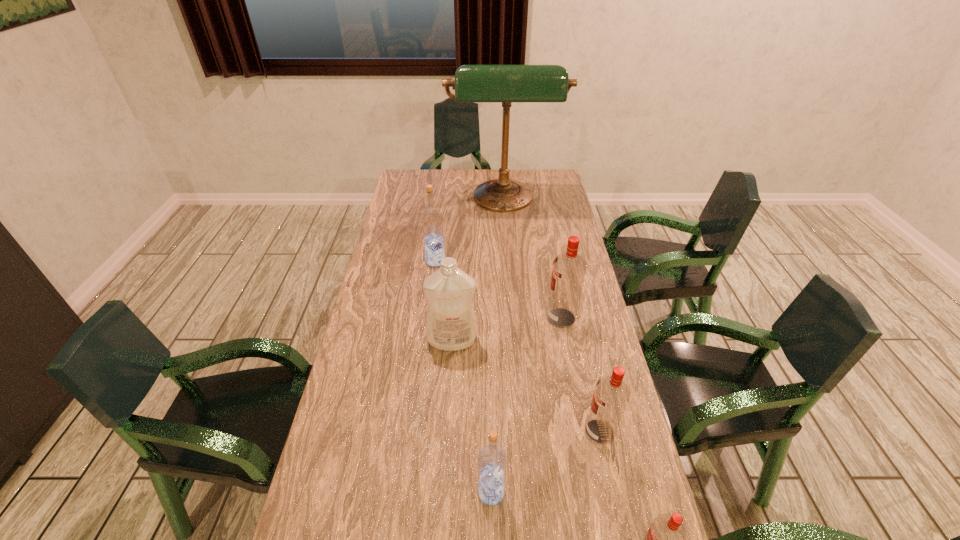
This screenshot has width=960, height=540. Find the location of `the farthest object`. the farthest object is located at coordinates (472, 83).

The image size is (960, 540). In order to click on the tallest object in this screenshot , I will do [x=472, y=83].

Identify the location of the farthest red vodka. The height and width of the screenshot is (540, 960). (568, 271).

Locate an element on the screen. Image resolution: width=960 pixels, height=540 pixels. the biggest red vodka is located at coordinates (568, 271).

I want to click on the sixth nearest object, so click(432, 223).

The height and width of the screenshot is (540, 960). I want to click on the farther blue vodka, so click(432, 223).

Where is `white detergent`? This screenshot has width=960, height=540. white detergent is located at coordinates (450, 321).

Image resolution: width=960 pixels, height=540 pixels. Identify the location of the third nearest object. (611, 395).

Identify the location of the second farthest red vodka. (611, 395).

Image resolution: width=960 pixels, height=540 pixels. In order to click on the fourth vodka from right to left in this screenshot , I will do `click(492, 460)`.